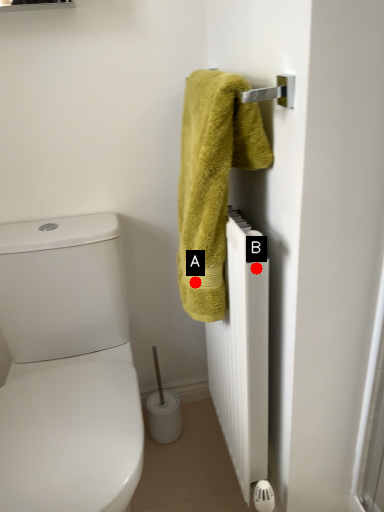
Question: Two points are circled on the image, labeled by A and B beside each circle. Which of the following is the farthest from the observer?

Choices:
 (A) A is further
 (B) B is further

Answer: (A)